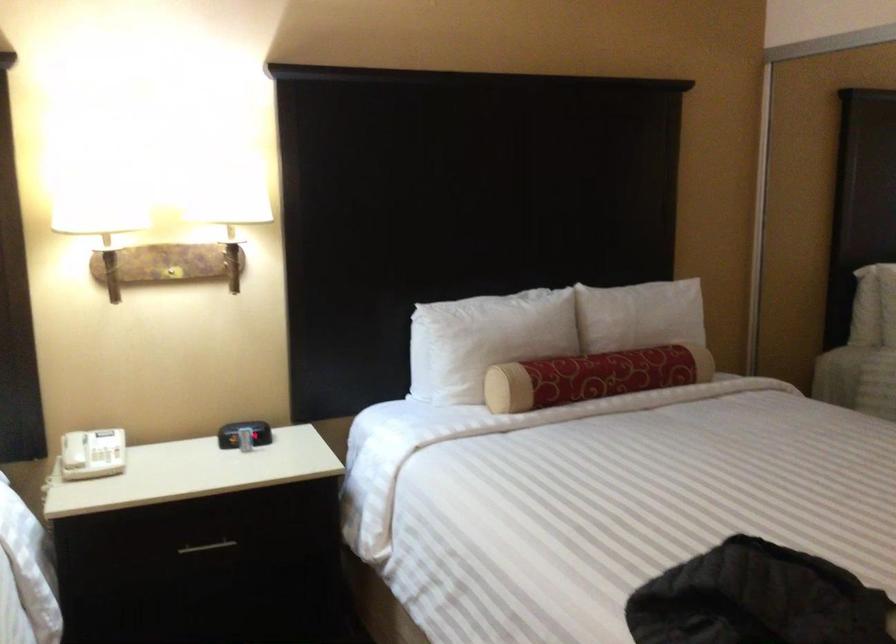
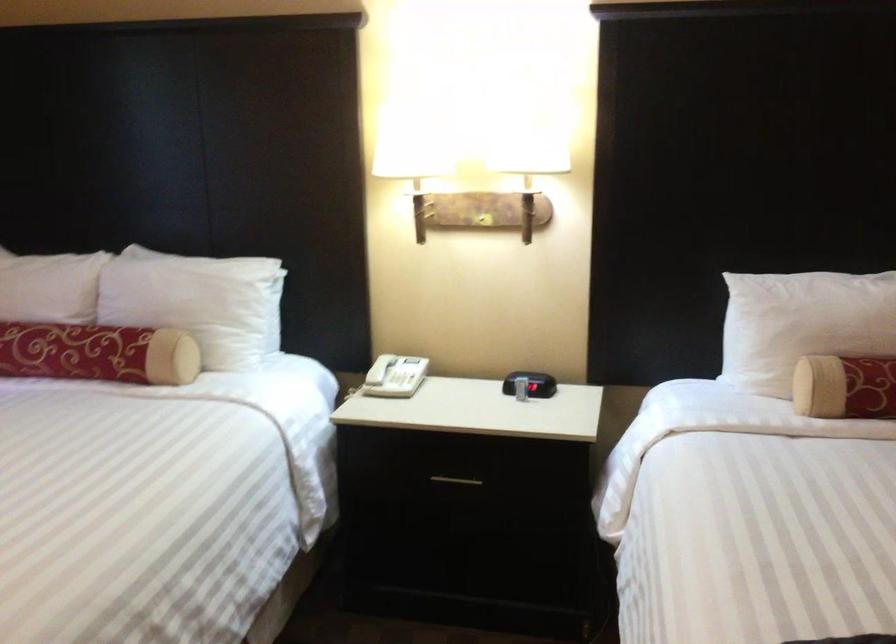
Find the pixel in the second image that matches point (532, 389) in the first image.

(845, 386)